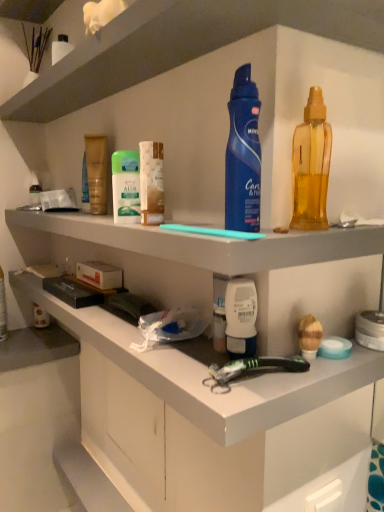
Identify the location of vacant space situated on the left part of black plastic toothbrush at lower center. This screenshot has height=512, width=384. (184, 373).